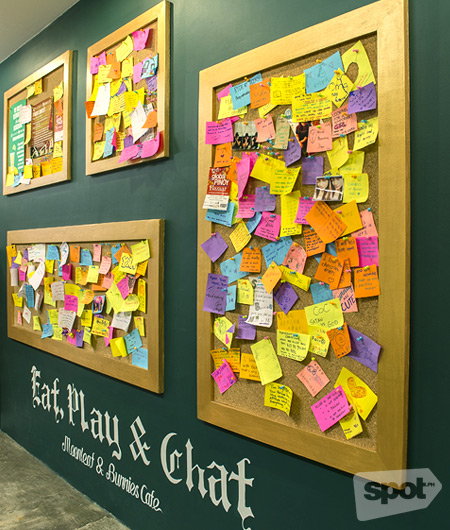
Point to all occurrences of post it note in the image. Your answer should be formatted as a list of tuples, i.e. [(x1, y1), (x2, y2), ...], where each tuple contains the x and y coordinates of a point satisfying the conditions above.

[(273, 401), (265, 359), (292, 346), (130, 342), (122, 323), (124, 287), (68, 319)]